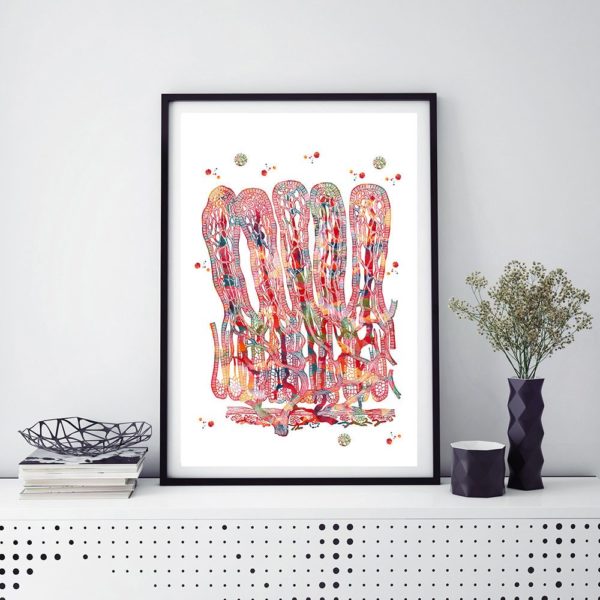
Find the location of a particular element. This screenshot has height=600, width=600. wall is located at coordinates (89, 152).